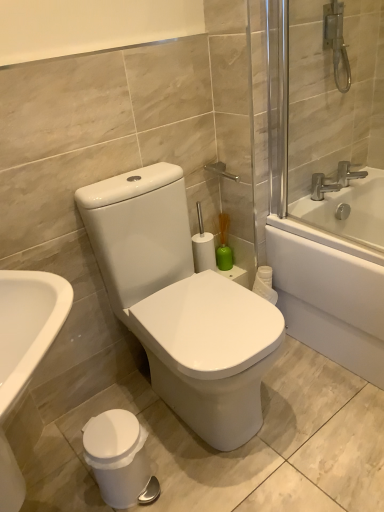
The width and height of the screenshot is (384, 512). I want to click on free spot in front of silver metallic faucet at upper right, the first tap from the right, so click(x=358, y=194).